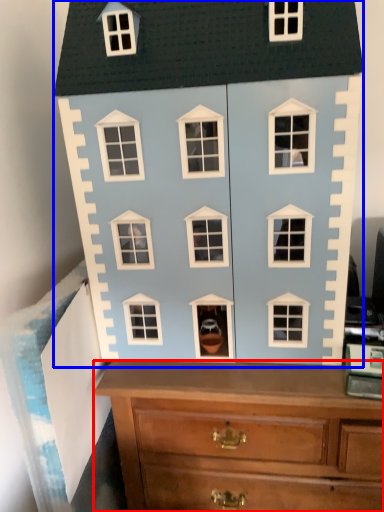
Question: Which point is closer to the camera, chest of drawers (highlighted by a red box) or toy (highlighted by a blue box)?

Choices:
 (A) chest of drawers
 (B) toy

Answer: (B)